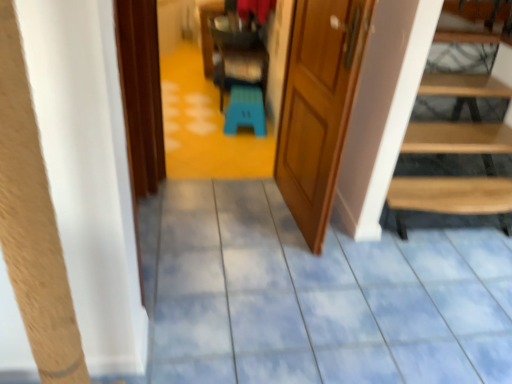
Image resolution: width=512 pixels, height=384 pixels. I want to click on free space above blue glossy tile floor at center (from a real-world perspective), so click(272, 276).